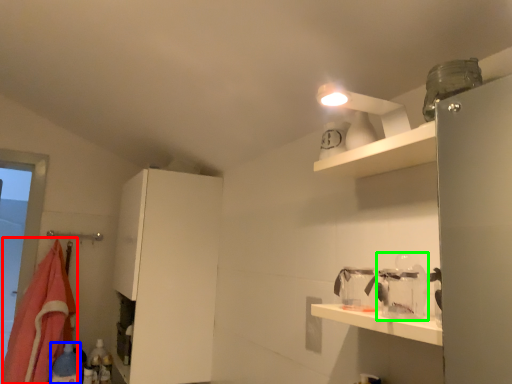
Question: Which object is positioned farthest from blanket (highlighted by a red box)? Select from bottle (highlighted by a blue box) and glass jar (highlighted by a green box).

Choices:
 (A) bottle
 (B) glass jar

Answer: (B)